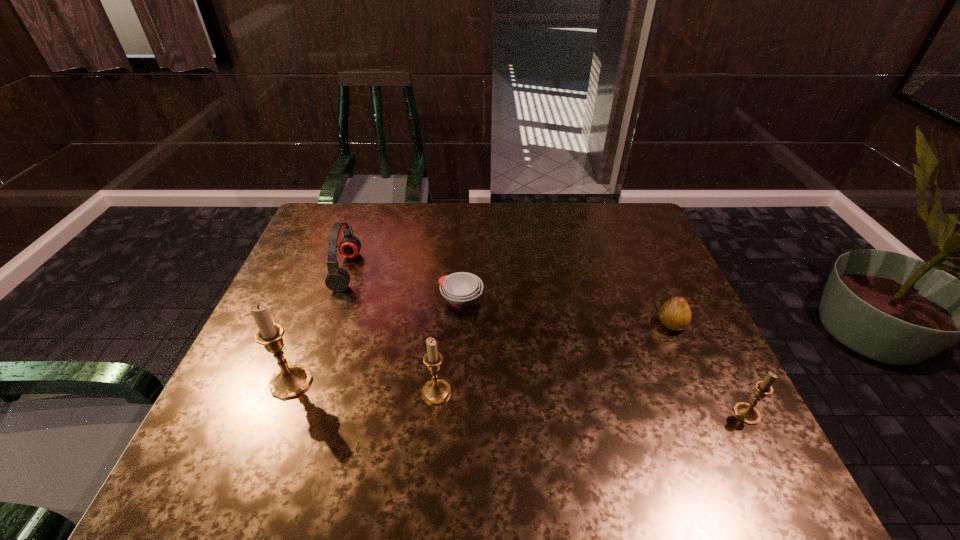
Find the location of a particular element. the tallest candle holder is located at coordinates (290, 381).

The height and width of the screenshot is (540, 960). I want to click on the leftmost candle holder, so click(290, 381).

This screenshot has width=960, height=540. I want to click on the second candle holder from right to left, so click(436, 391).

Locate an element on the screen. The image size is (960, 540). the rightmost candle holder is located at coordinates (747, 413).

Find the location of `the rightmost object`. the rightmost object is located at coordinates click(x=747, y=413).

Identify the location of the fifth tallest object. The image size is (960, 540). (675, 314).

Where is `the fifth object from left to right`? The height and width of the screenshot is (540, 960). the fifth object from left to right is located at coordinates (675, 314).

Where is `soup bowl`? The height and width of the screenshot is (540, 960). soup bowl is located at coordinates (461, 289).

What are the coordinates of `earphone` in the screenshot? It's located at (337, 280).

Locate an element on the screen. The image size is (960, 540). blank space located on the back of the tallest candle holder is located at coordinates (303, 349).